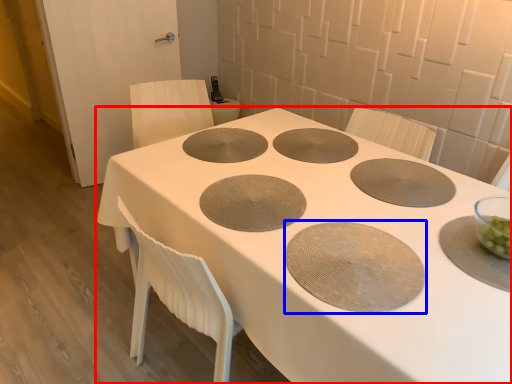
Question: Which object is closer to the camera taking this photo, table (highlighted by a red box) or oval (highlighted by a blue box)?

Choices:
 (A) table
 (B) oval

Answer: (A)